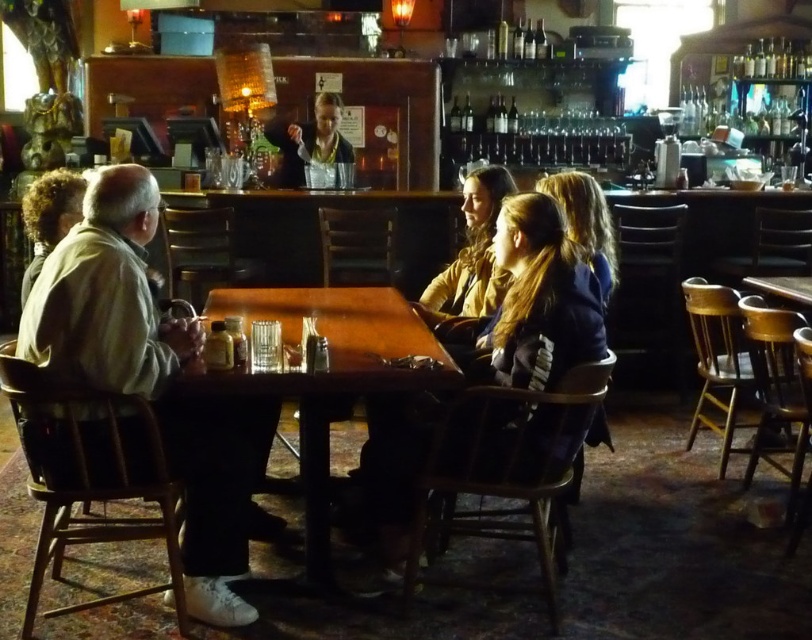
Question: Where is dark brown leather jacket at center located in relation to matte black jacket at center in the image?

Choices:
 (A) right
 (B) left

Answer: (A)

Question: Is dark brown leather jacket at center to the left of curly hair at left from the viewer's perspective?

Choices:
 (A) no
 (B) yes

Answer: (A)

Question: Which point is closer to the camera?

Choices:
 (A) (245, 492)
 (B) (394, 385)
 (C) (810, 38)
 (D) (29, 262)

Answer: (B)

Question: Which of the following is the farthest from the observer?

Choices:
 (A) (767, 72)
 (B) (24, 268)

Answer: (A)

Question: Can you confirm if wooden table at center is positioned to the right of matte black jacket at center?

Choices:
 (A) yes
 (B) no

Answer: (A)

Question: Which of the following is the closest to the observer?

Choices:
 (A) light brown leather jacket at left
 (B) wooden table at center
 (C) curly hair at left

Answer: (A)